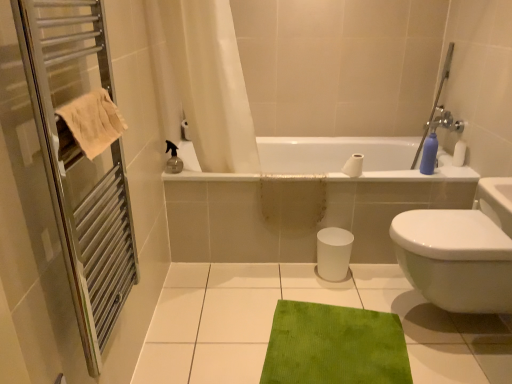
The image size is (512, 384). Identify the location of vacant point to the left of white glossy bidet at lower right. (346, 322).